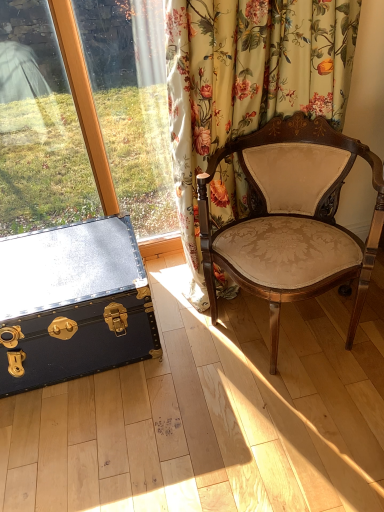
The width and height of the screenshot is (384, 512). I want to click on vacant area that lies to the right of black leather trunk at lower left, so click(x=204, y=366).